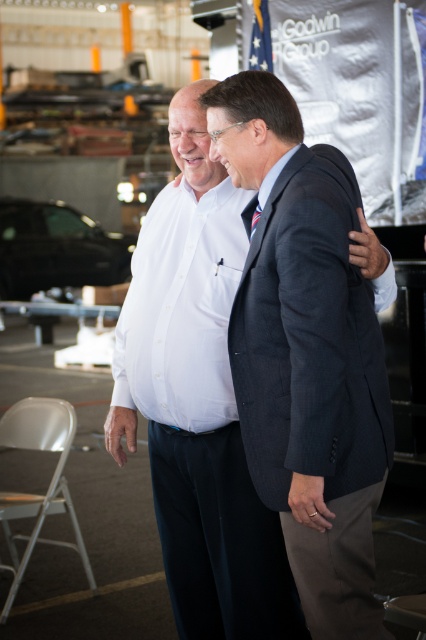
Does white shirt at center have a greater height compared to striped silk tie at center?

Indeed, white shirt at center has a greater height compared to striped silk tie at center.

Can you confirm if white shirt at center is wider than striped silk tie at center?

Correct, the width of white shirt at center exceeds that of striped silk tie at center.

Is point (256, 188) positioned behind point (244, 209)?

That is False.

This screenshot has width=426, height=640. What are the coordinates of `white shirt at center` in the screenshot? It's located at (250, 141).

Is point (28, 237) farther from camera compared to point (245, 224)?

Yes, it is behind point (245, 224).

Is shiny black car at center thinner than striped silk tie at center?

No, shiny black car at center is not thinner than striped silk tie at center.

Describe the element at coordinates (57, 248) in the screenshot. I see `shiny black car at center` at that location.

Locate an element on the screen. shiny black car at center is located at coordinates (57, 248).

Is white shirt at center below shiny black car at center?

Indeed, white shirt at center is positioned under shiny black car at center.

Does white shirt at center lie in front of shiny black car at center?

Yes, it is in front of shiny black car at center.

I want to click on white shirt at center, so click(250, 141).

Find the location of `white shirt at center`. white shirt at center is located at coordinates (250, 141).